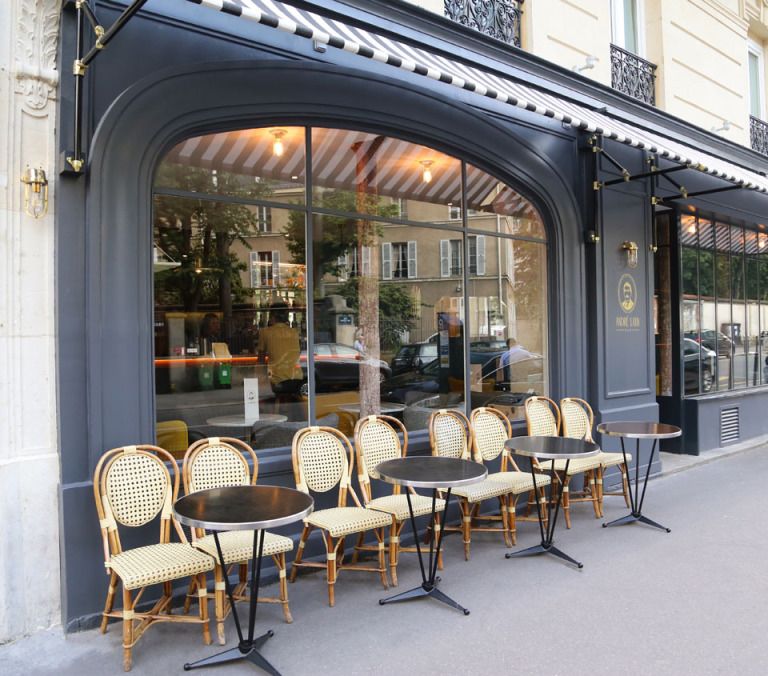
Find the location of a particular element. Image resolution: width=768 pixels, height=676 pixels. shutters in reflection is located at coordinates (x=481, y=266), (x=447, y=268), (x=412, y=264), (x=388, y=264), (x=280, y=254), (x=253, y=256).